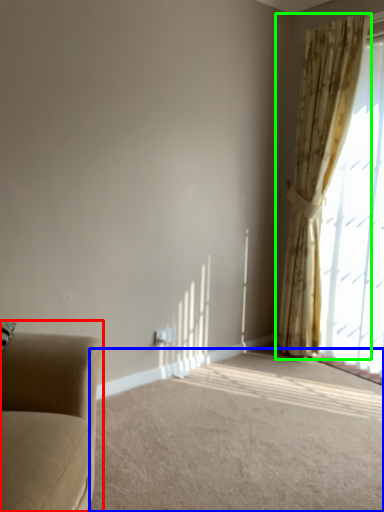
Question: Which is farther away from studio couch (highlighted by a red box)? plain (highlighted by a blue box) or curtain (highlighted by a green box)?

Choices:
 (A) plain
 (B) curtain

Answer: (B)